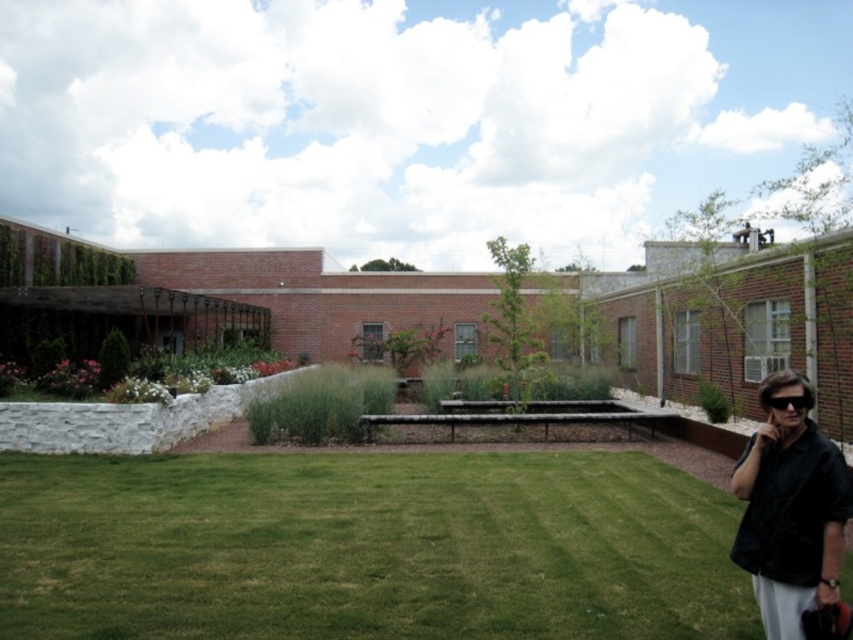
You are a delivery person trying to place a small box between the black matte jacket at lower right and the black plastic goggles at lower right. Can you fit the box there if the box is 15 cm wide?

The black matte jacket at lower right might be wider than black plastic goggles at lower right, so the space between them may not be sufficient for a 15 cm wide box. Check the actual distance before placing the box.

You are standing in the courtyard and want to know how far the point at coordinates (555,566) is from you. Can you determine the distance?

The point at coordinates (555,566) is 5.62 meters away from you.